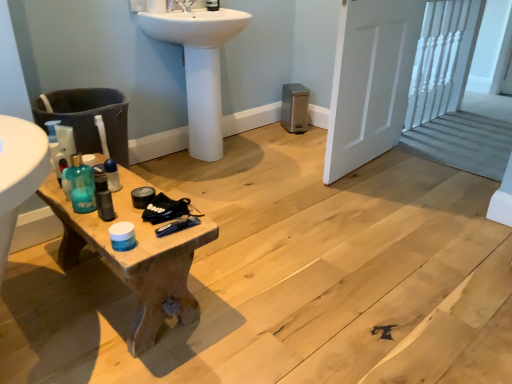
Question: Is white glossy sink at upper center located within matte black soap dispenser at upper center, the second toiletry positioned from the bottom?

Choices:
 (A) no
 (B) yes

Answer: (A)

Question: Is matte black soap dispenser at upper center, placed as the 1th toiletry when sorted from top to bottom, wider than white glossy sink at upper center?

Choices:
 (A) yes
 (B) no

Answer: (B)

Question: Is matte black soap dispenser at upper center, the 1th toiletry in the back-to-front sequence, bigger than white glossy sink at upper center?

Choices:
 (A) yes
 (B) no

Answer: (B)

Question: Can you confirm if matte black soap dispenser at upper center, the second toiletry positioned from the bottom, is taller than white glossy sink at upper center?

Choices:
 (A) yes
 (B) no

Answer: (B)

Question: Considering the relative sizes of matte black soap dispenser at upper center, the 2th toiletry from the left, and white glossy sink at upper center in the image provided, is matte black soap dispenser at upper center, the 2th toiletry from the left, shorter than white glossy sink at upper center?

Choices:
 (A) no
 (B) yes

Answer: (B)

Question: From a real-world perspective, is matte black soap dispenser at upper center, acting as the first toiletry starting from the right, over white glossy sink at upper center?

Choices:
 (A) no
 (B) yes

Answer: (B)

Question: Can you confirm if white wooden door at right is bigger than translucent plastic bottle at center, positioned as the second toiletry in top-to-bottom order?

Choices:
 (A) yes
 (B) no

Answer: (A)

Question: From the image's perspective, is white wooden door at right beneath translucent plastic bottle at center, positioned as the second toiletry in top-to-bottom order?

Choices:
 (A) no
 (B) yes

Answer: (A)

Question: Is white wooden door at right aimed at translucent plastic bottle at center, the first toiletry ordered from the bottom?

Choices:
 (A) yes
 (B) no

Answer: (B)

Question: Is white wooden door at right directly adjacent to translucent plastic bottle at center, the 1th toiletry from the left?

Choices:
 (A) no
 (B) yes

Answer: (A)

Question: Is white wooden door at right further to camera compared to translucent plastic bottle at center, positioned as the second toiletry in top-to-bottom order?

Choices:
 (A) yes
 (B) no

Answer: (A)

Question: From a real-world perspective, is white wooden door at right below translucent plastic bottle at center, positioned as the second toiletry in top-to-bottom order?

Choices:
 (A) no
 (B) yes

Answer: (A)

Question: From the image's perspective, is matte black soap dispenser at upper center, acting as the second toiletry starting from the front, on top of translucent plastic bottle at left?

Choices:
 (A) yes
 (B) no

Answer: (A)